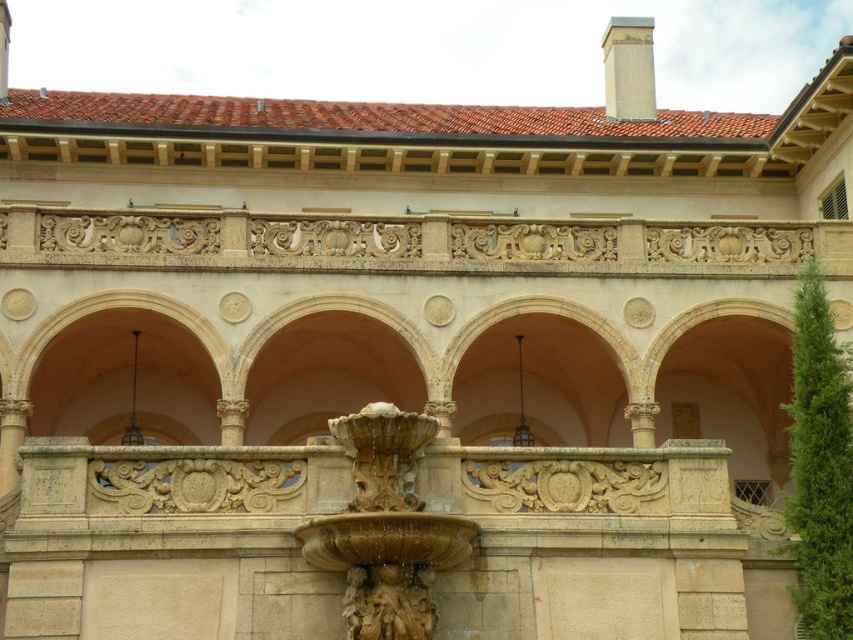
You are an architect evaluating the building design. You see the carved stone fountain at center and the smooth beige chimney at upper center. Which object is taller?

The smooth beige chimney at upper center is taller than the carved stone fountain at center.

You are an architect examining the building facade. You notice the carved stone fountain at center and the smooth beige chimney at upper center. Which object is positioned higher on the building?

The smooth beige chimney at upper center is positioned higher on the building than the carved stone fountain at center.